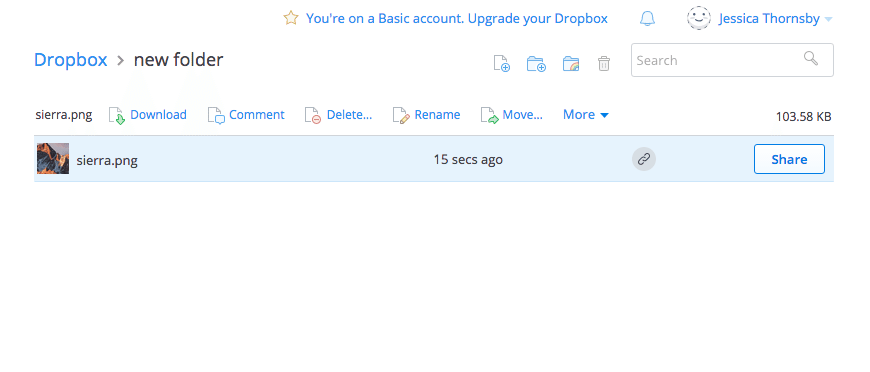
Where is `picture`? picture is located at coordinates (57, 158).